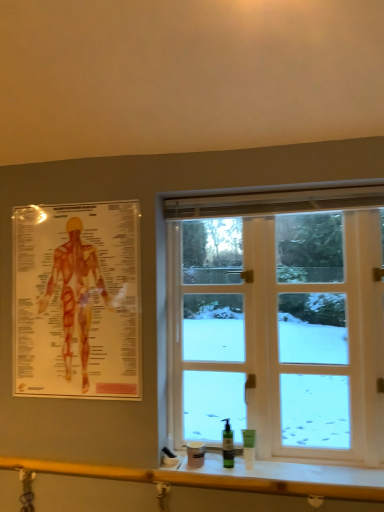
I want to click on empty space that is to the right of green matte pump bottle at lower center, the 2th toiletry when ordered from right to left, so click(268, 460).